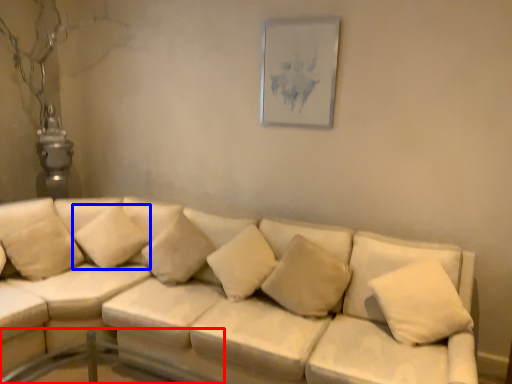
Question: Which of the following is the closest to the observer, glass table (highlighted by a red box) or pillow (highlighted by a blue box)?

Choices:
 (A) glass table
 (B) pillow

Answer: (A)